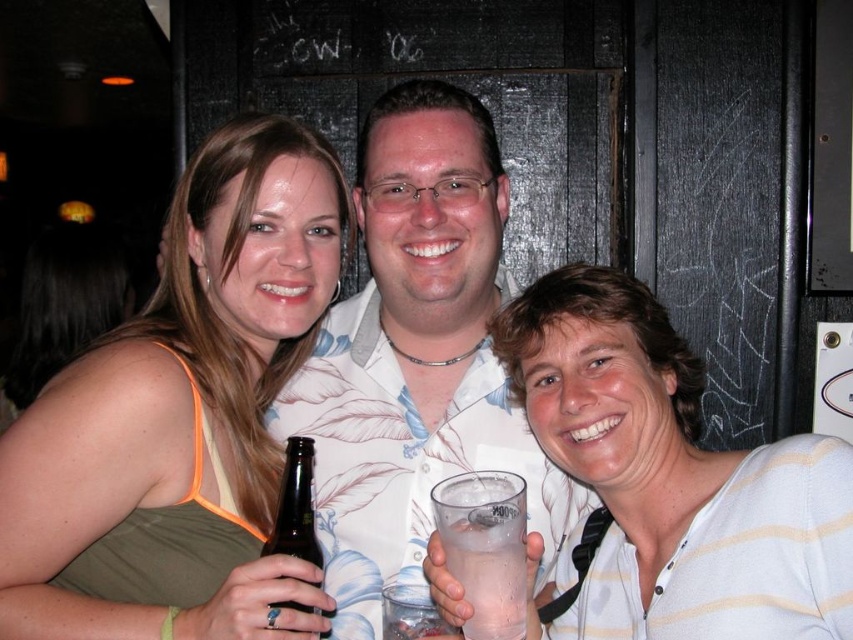
Question: Based on their relative distances, which object is nearer to the green fabric tank top at left?

Choices:
 (A) brown glass bottle at lower left
 (B) white floral shirt at center
 (C) clear plastic cup at center
 (D) white striped shirt at center

Answer: (B)

Question: Which point is farther to the camera?

Choices:
 (A) brown glass bottle at lower left
 (B) green fabric tank top at left
 (C) white striped shirt at center

Answer: (A)

Question: Which point is closer to the camera?

Choices:
 (A) green fabric tank top at left
 (B) white floral shirt at center
 (C) brown glass bottle at lower left
 (D) clear plastic cup at center

Answer: (A)

Question: In this image, where is white floral shirt at center located relative to clear plastic cup at center?

Choices:
 (A) below
 (B) above

Answer: (B)

Question: Can you confirm if white floral shirt at center is positioned above clear plastic cup at center?

Choices:
 (A) yes
 (B) no

Answer: (A)

Question: Does white floral shirt at center have a greater width compared to brown glass bottle at lower left?

Choices:
 (A) no
 (B) yes

Answer: (B)